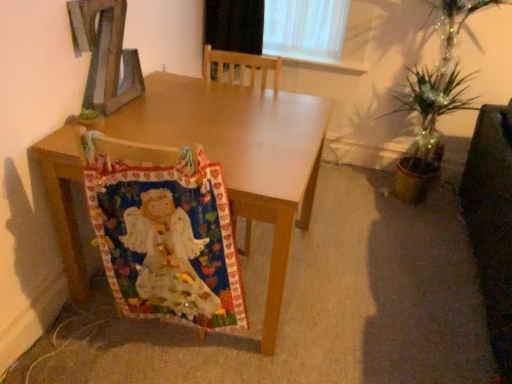
The image size is (512, 384). What are the coordinates of `empty space that is to the right of wooden letter z at upper left` in the screenshot? It's located at (145, 105).